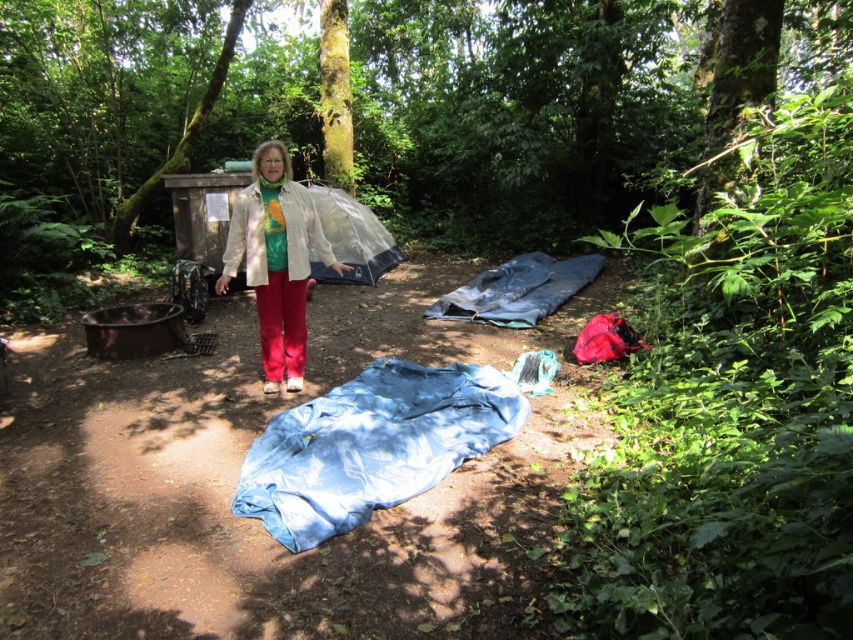
Where is `blue tarp at center`? The height and width of the screenshot is (640, 853). blue tarp at center is located at coordinates (370, 445).

Does blue tarp at center have a greater height compared to light beige jacket at center?

No, blue tarp at center is not taller than light beige jacket at center.

Image resolution: width=853 pixels, height=640 pixels. In order to click on blue tarp at center in this screenshot , I will do `click(370, 445)`.